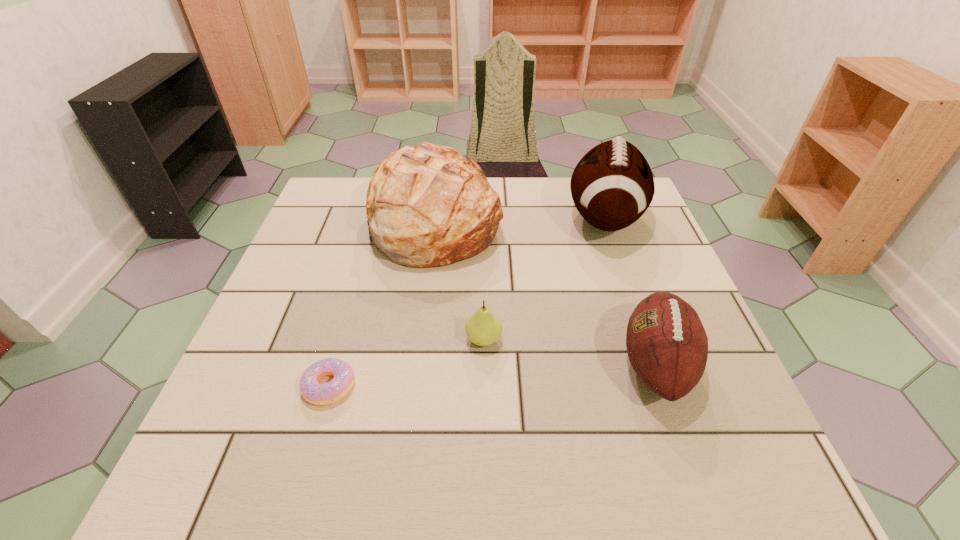
The image size is (960, 540). I want to click on bread, so click(428, 206).

Locate an element on the screen. the taller football (American) is located at coordinates (612, 186).

Identify the location of the shorter football (American). (667, 345).

Locate an element on the screen. the nearer football (American) is located at coordinates (667, 345).

Where is `the second shortest object`? This screenshot has width=960, height=540. the second shortest object is located at coordinates (483, 328).

Locate an element on the screen. the shortest object is located at coordinates (319, 394).

At what (x,y) coordinates should I click in order to perform the action: click on vacant space located 0.160m on the left of the bread. Please return your answer as a coordinate pair (x, y). Looking at the image, I should click on (308, 220).

Identify the location of vacant position located 0.180m on the front of the taller football (American). (637, 312).

Where is `free location located on the left of the shorter football (American)`? The width and height of the screenshot is (960, 540). free location located on the left of the shorter football (American) is located at coordinates (542, 364).

I want to click on free space located 0.080m on the back of the second shortest object, so click(483, 299).